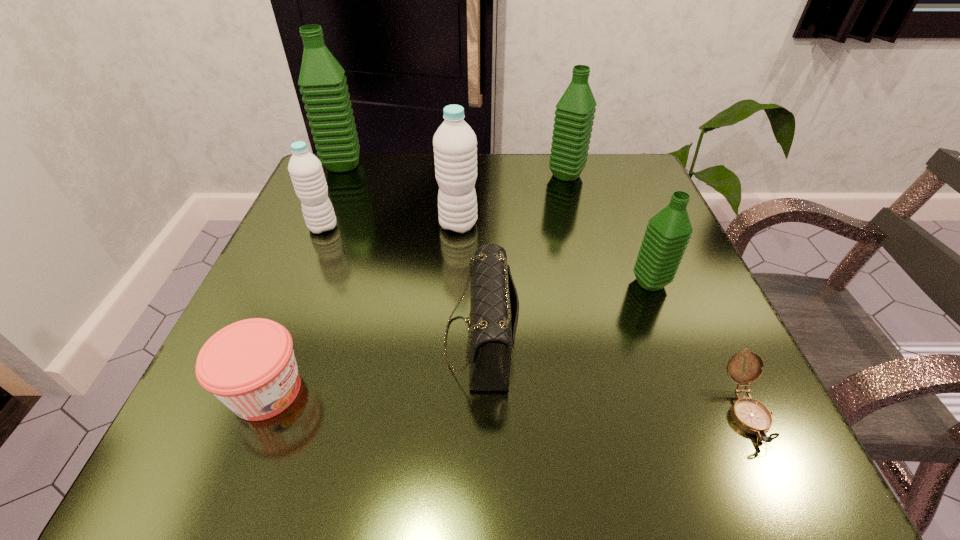
This screenshot has width=960, height=540. Find the location of `jam`. jam is located at coordinates (250, 366).

I want to click on the rightmost object, so click(750, 415).

You are a GUI agent. You are given a task and a screenshot of the screen. Output one action in this format:
    pyautogui.click(x=<x>, y=<y>)
    Task: Click on the shortest object
    The image size is (960, 540).
    Given the screenshot: What is the action you would take?
    pyautogui.click(x=750, y=415)

The image size is (960, 540). In order to click on vacant space located 0.300m on the front of the biggest green water bottle in this screenshot , I will do `click(300, 262)`.

Identify the location of free space located on the front of the second smallest green water bottle. (573, 200).

Locate an element on the screen. The height and width of the screenshot is (540, 960). vacant space located on the left of the third water bottle from left to right is located at coordinates (290, 225).

Locate an element on the screen. vacant position located on the right of the left white water bottle is located at coordinates (483, 227).

At what (x,y) coordinates should I click in order to perform the action: click on vacant point located on the back of the nearest water bottle. Please return your answer as a coordinate pair (x, y). This screenshot has height=540, width=960. Looking at the image, I should click on (633, 239).

The height and width of the screenshot is (540, 960). I want to click on free space located 0.310m on the front flap of the third shortest object, so click(243, 340).

You are a GUI agent. You are given a task and a screenshot of the screen. Output one action in this format:
    pyautogui.click(x=<x>, y=<y>)
    Task: Click on the free point located 0.110m on the front flap of the third shortest object
    This screenshot has height=540, width=960.
    Given the screenshot: What is the action you would take?
    pyautogui.click(x=372, y=340)